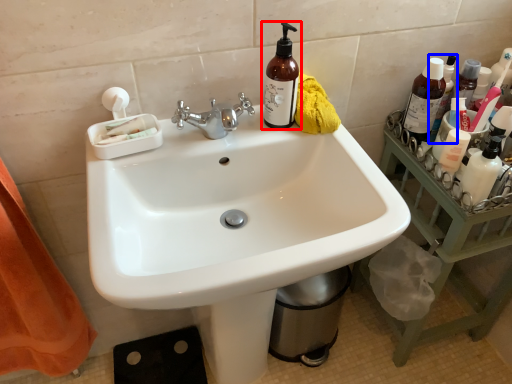
Question: Among these objects, which one is nearest to the camera, bottle (highlighted by a red box) or bottle (highlighted by a blue box)?

Choices:
 (A) bottle
 (B) bottle

Answer: (A)